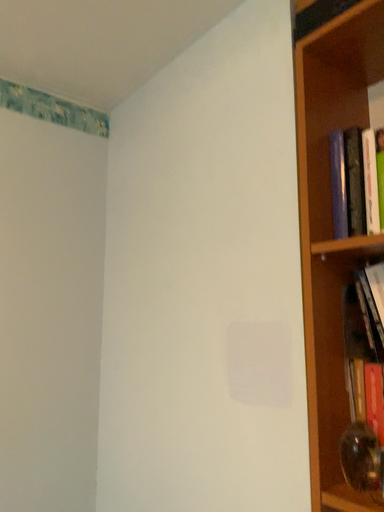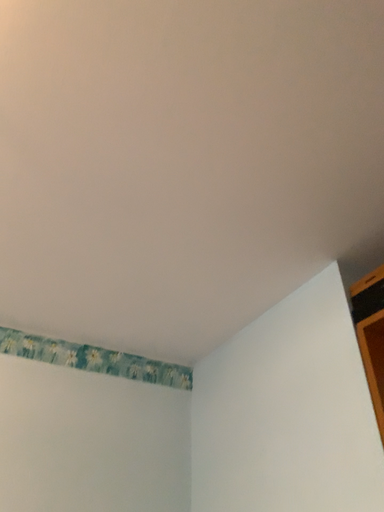
Question: How did the camera likely rotate when shooting the video?

Choices:
 (A) rotated left
 (B) rotated right

Answer: (A)